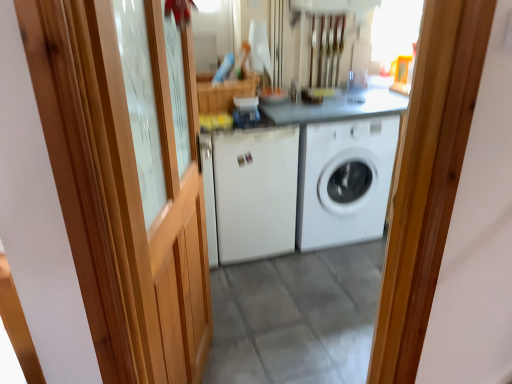
Question: Choose the correct answer: Is white matte washing machine at center, arranged as the second washing machine when viewed from the left, inside wooden barn door at left or outside it?

Choices:
 (A) outside
 (B) inside

Answer: (A)

Question: Considering the positions of white matte washing machine at center, the first washing machine positioned from the right, and wooden barn door at left in the image, is white matte washing machine at center, the first washing machine positioned from the right, bigger or smaller than wooden barn door at left?

Choices:
 (A) big
 (B) small

Answer: (A)

Question: Estimate the real-world distances between objects in this image. Which object is farther from the wooden barn door at left?

Choices:
 (A) white matte washing machine at center, arranged as the second washing machine when viewed from the left
 (B) white matte washing machine at center, the 2th washing machine from the right

Answer: (A)

Question: Estimate the real-world distances between objects in this image. Which object is farther from the white matte washing machine at center, the first washing machine positioned from the right?

Choices:
 (A) wooden barn door at left
 (B) white matte washing machine at center, the 2th washing machine from the right

Answer: (A)